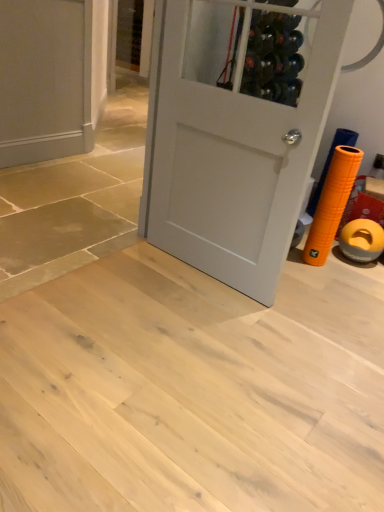
Question: In terms of height, does matte gray door at upper left, which is the 1th door from left to right, look taller or shorter compared to white matte door at center, the 2th door when ordered from left to right?

Choices:
 (A) short
 (B) tall

Answer: (A)

Question: From the image's perspective, is matte gray door at upper left, which is the 1th door from left to right, located above or below white matte door at center, which is the 1th door in front-to-back order?

Choices:
 (A) above
 (B) below

Answer: (A)

Question: Is matte gray door at upper left, the first door viewed from the back, wider or thinner than white matte door at center, which is the 1th door in front-to-back order?

Choices:
 (A) thin
 (B) wide

Answer: (A)

Question: Looking at the image, does white matte door at center, which is the 2th door from back to front, seem bigger or smaller compared to matte gray door at upper left, the first door viewed from the back?

Choices:
 (A) big
 (B) small

Answer: (A)

Question: Is point (268, 252) closer or farther from the camera than point (13, 11)?

Choices:
 (A) closer
 (B) farther

Answer: (A)

Question: In terms of height, does white matte door at center, the 2th door when ordered from left to right, look taller or shorter compared to matte gray door at upper left, which ranks as the 2th door in right-to-left order?

Choices:
 (A) tall
 (B) short

Answer: (A)

Question: Would you say white matte door at center, the 2th door when ordered from left to right, is to the left or to the right of matte gray door at upper left, which is the second door from front to back, in the picture?

Choices:
 (A) left
 (B) right

Answer: (B)